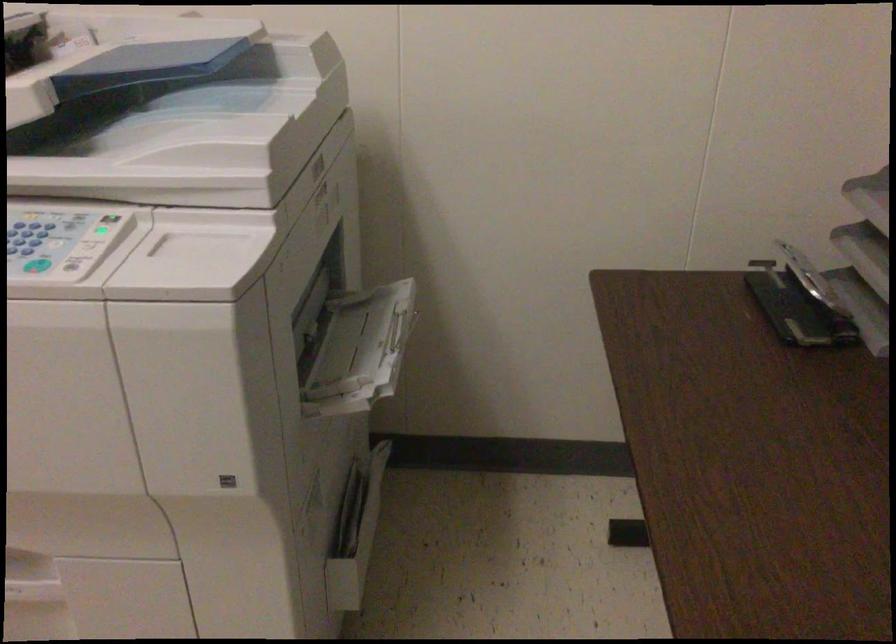
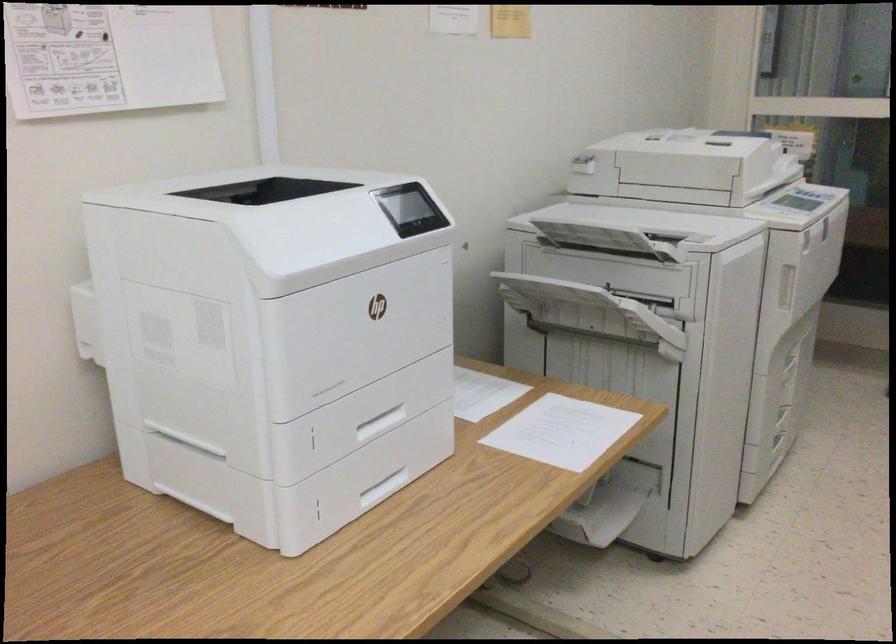
Question: I am providing you with two images of the same scene from different viewpoints. After the viewpoint changes to image2, which objects are now occluded?

Choices:
 (A) printer access handle
 (B) copier output tray
 (C) textured black pillow
 (D) document feeder lid

Answer: (A)